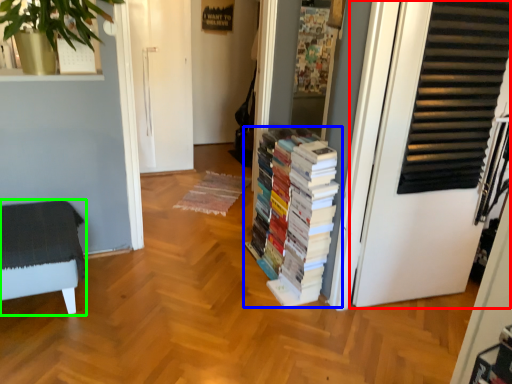
Question: Which object is the farthest from door (highlighted by a red box)? Choose among these: book (highlighted by a blue box) or furniture (highlighted by a green box).

Choices:
 (A) book
 (B) furniture

Answer: (B)